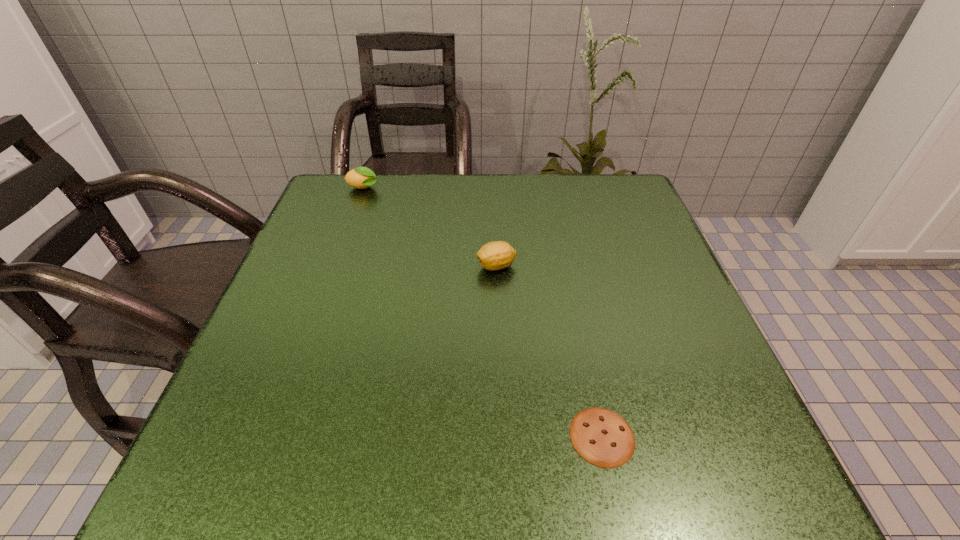
Locate an element on the screen. The height and width of the screenshot is (540, 960). free point that satisfies the following two spatial constraints: 1. at the stem end of the nearer lemon; 2. on the back side of the shortest object is located at coordinates 504,436.

You are a GUI agent. You are given a task and a screenshot of the screen. Output one action in this format:
    pyautogui.click(x=<x>, y=<y>)
    Task: Click on the free space that satisfies the following two spatial constraints: 1. at the stem end of the second object from left to right; 2. on the back side of the rightmost object
    Image resolution: width=960 pixels, height=540 pixels.
    Given the screenshot: What is the action you would take?
    pyautogui.click(x=504, y=436)

I want to click on vacant space that satisfies the following two spatial constraints: 1. at the stem end of the nearest object; 2. on the right side of the second object from left to right, so click(504, 436).

Where is `vacant area that satisfies the following two spatial constraints: 1. at the stem end of the right lemon; 2. on the back side of the nearest object`? vacant area that satisfies the following two spatial constraints: 1. at the stem end of the right lemon; 2. on the back side of the nearest object is located at coordinates (504, 436).

Identify the location of vacant region that satisfies the following two spatial constraints: 1. at the stem end of the cookie; 2. on the left side of the second object from right to left. (504, 436).

I want to click on vacant area in the image that satisfies the following two spatial constraints: 1. at the stem end of the cookie; 2. on the right side of the nearer lemon, so click(504, 436).